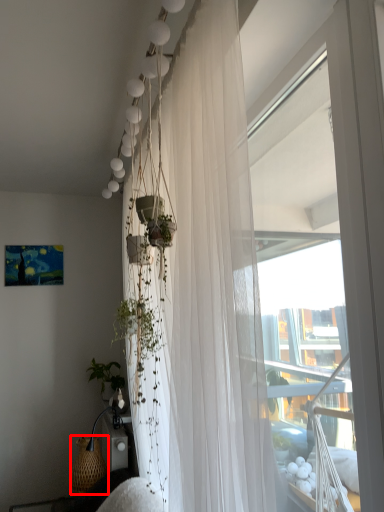
Question: From the image's perspective, considering the relative positions of basket (annotated by the red box) and curtain in the image provided, where is basket (annotated by the red box) located with respect to the staircase?

Choices:
 (A) below
 (B) above

Answer: (A)